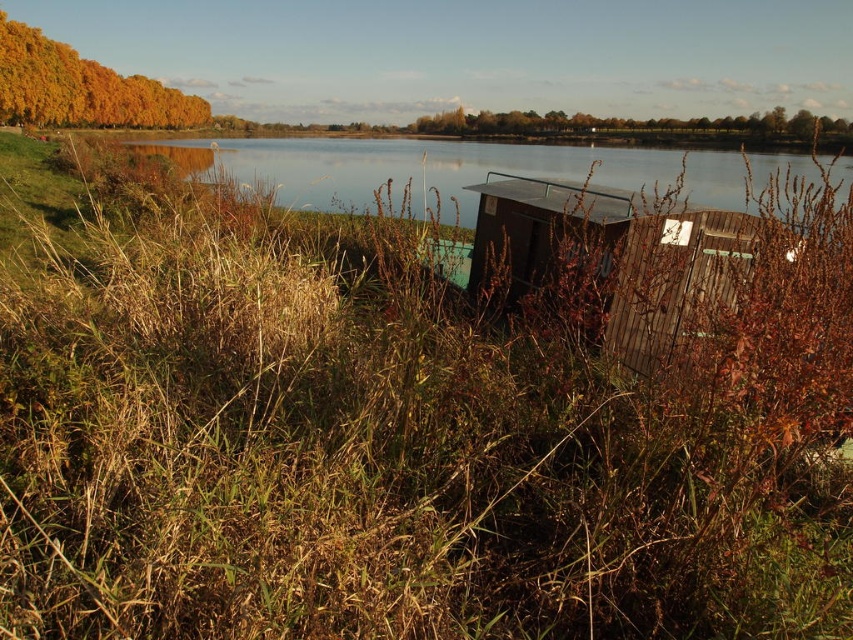
Which is behind, point (45, 100) or point (672, 129)?

The point (672, 129) is behind.

This screenshot has height=640, width=853. Describe the element at coordinates (80, 88) in the screenshot. I see `golden foliage at upper left` at that location.

Which is in front, point (143, 109) or point (776, 132)?

Point (143, 109) is in front.

Locate an element on the screen. This screenshot has width=853, height=640. golden foliage at upper left is located at coordinates (80, 88).

Is point (163, 145) positioned behind point (424, 128)?

No, it is not.

Is point (328, 205) closer to camera compared to point (653, 129)?

That is True.

Identify the location of transparent glass water at center. This screenshot has width=853, height=640. [428, 170].

Which is more to the left, transparent glass water at center or golden foliage at upper left?

golden foliage at upper left is more to the left.

Does transparent glass water at center have a greater height compared to golden foliage at upper left?

Correct, transparent glass water at center is much taller as golden foliage at upper left.

What do you see at coordinates (428, 170) in the screenshot? This screenshot has width=853, height=640. I see `transparent glass water at center` at bounding box center [428, 170].

The image size is (853, 640). What are the coordinates of `transparent glass water at center` in the screenshot? It's located at (428, 170).